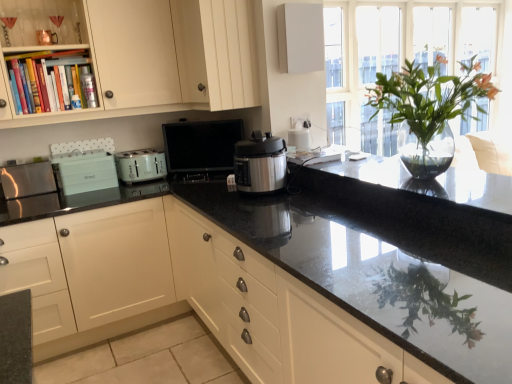
Question: Is point (125, 183) closer or farther from the camera than point (77, 162)?

Choices:
 (A) farther
 (B) closer

Answer: (A)

Question: Is matte green toaster at center to the left or to the right of matte teal toaster at left, which is counted as the 2th appliance, starting from the left, in the image?

Choices:
 (A) left
 (B) right

Answer: (B)

Question: Which object is positioned farthest from the clear glass vase at upper right?

Choices:
 (A) matte black microwave at center, which is the 3th appliance from left to right
 (B) black granite countertop at center, arranged as the second countertop when ordered from the bottom
 (C) matte green toaster at center
 (D) stainless steel pressure cooker at center
 (E) brushed metal toaster at left, acting as the 3th appliance starting from the right

Answer: (E)

Question: Considering the real-world distances, which object is farthest from the clear glass vase at upper right?

Choices:
 (A) matte green toaster at center
 (B) black granite countertop at center, which is the first countertop from bottom to top
 (C) matte white cabinet at center, which is counted as the 1th cabinetry, starting from the bottom
 (D) stainless steel pressure cooker at center
 (E) brushed metal toaster at left, positioned as the first appliance in left-to-right order

Answer: (E)